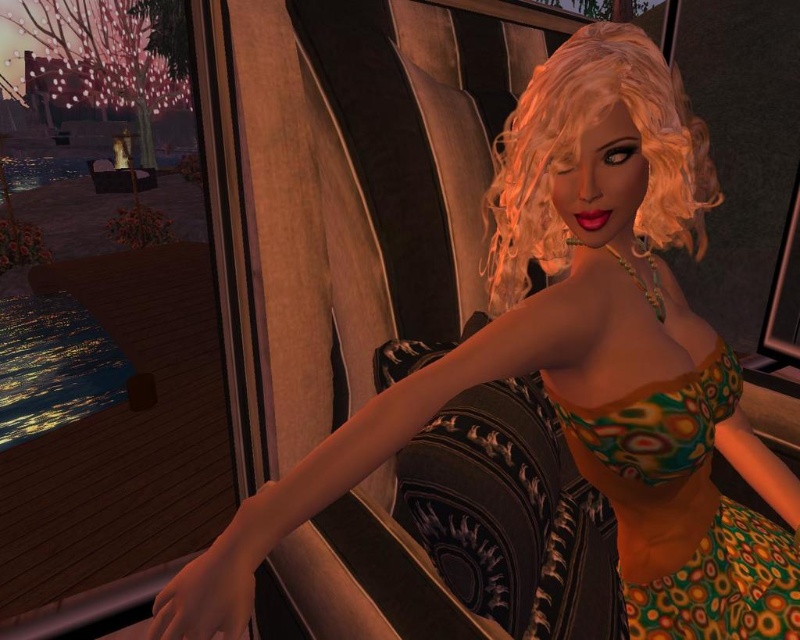
You are a fashion designer observing the scene and need to choose between the blonde curly wig at upper right and the multicolored printed dress at center for a runway show. Based on their sizes, which item would you select to ensure it stands out more visually?

The blonde curly wig at upper right is bigger than the multicolored printed dress at center, so selecting the blonde curly wig at upper right would make it stand out more visually.

You are a fashion designer who needs to place a new accessory between the blonde curly wig at upper right and the multicolored printed dress at center. The accessory you have is 10 inches wide. Can you fit it between them without overlapping either item?

The distance between the blonde curly wig at upper right and the multicolored printed dress at center is 22.60 inches. Since the accessory is only 10 inches wide, there is enough space to place it between them without overlapping either item.